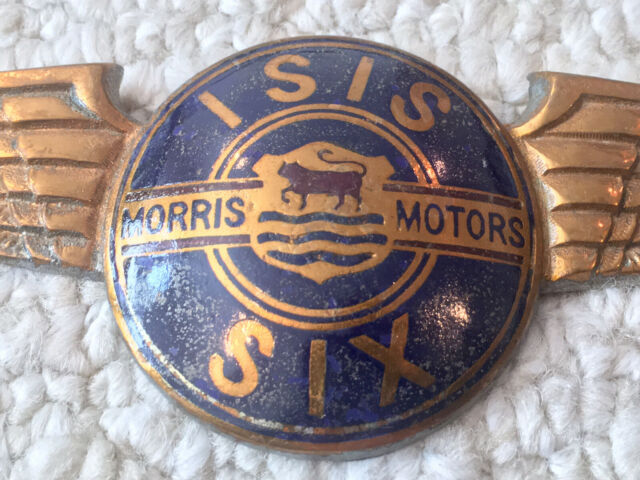
Identify the location of blue enamel base. The width and height of the screenshot is (640, 480). (445, 337).